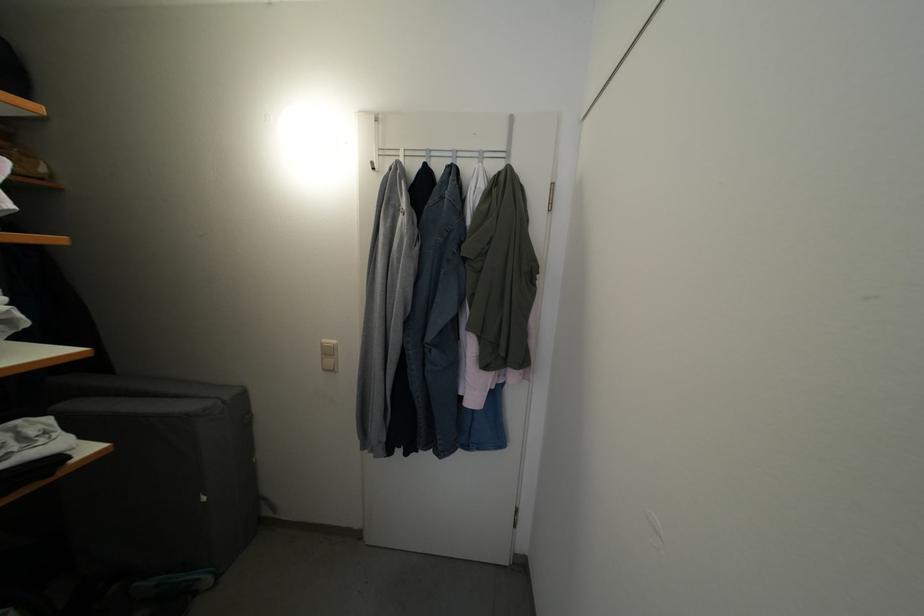
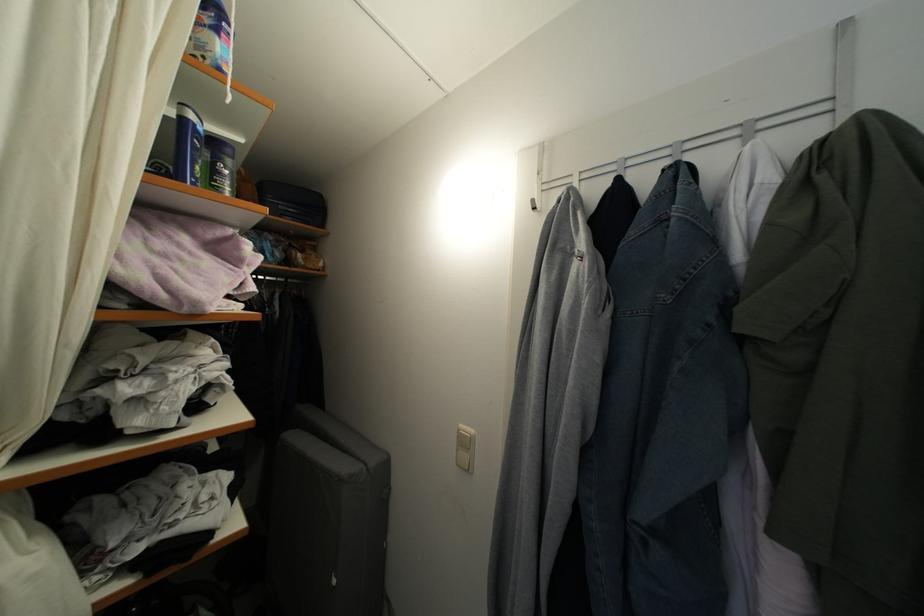
In the second image, find the point that corresponds to [210,505] in the first image.

(339, 588)